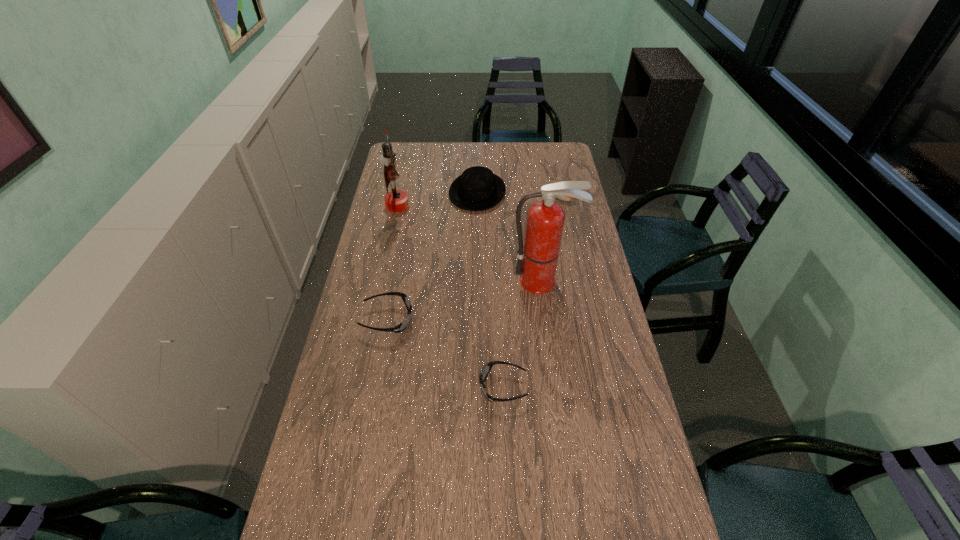
In the image, there is a desktop. Where is `vacant space at the far edge`? vacant space at the far edge is located at coordinates (520, 153).

Identify the location of vacant area at the left edge. (367, 321).

This screenshot has width=960, height=540. Find the location of `vacant position at the right edge of the desktop`. vacant position at the right edge of the desktop is located at coordinates (571, 341).

Where is `vacant space at the far left corner of the desktop`? The height and width of the screenshot is (540, 960). vacant space at the far left corner of the desktop is located at coordinates (394, 147).

Find the location of a particular element. free spot between the nutcracker and the fedora is located at coordinates (438, 199).

You are a GUI agent. You are given a task and a screenshot of the screen. Output one action in this format:
    pyautogui.click(x=<x>, y=<y>)
    Task: Click on the free area in between the third tallest object and the fifth farthest object
    
    Given the screenshot: What is the action you would take?
    pyautogui.click(x=432, y=255)

This screenshot has height=540, width=960. I want to click on free space between the third nearest object and the nutcracker, so click(470, 243).

Where is `empty location between the fourth farthest object and the fedora`? empty location between the fourth farthest object and the fedora is located at coordinates (510, 237).

Locate an element on the screen. The width and height of the screenshot is (960, 540). vacant point located between the fourth farthest object and the fedora is located at coordinates (510, 237).

The width and height of the screenshot is (960, 540). I want to click on unoccupied area between the second nearest object and the fourth shortest object, so click(x=432, y=255).